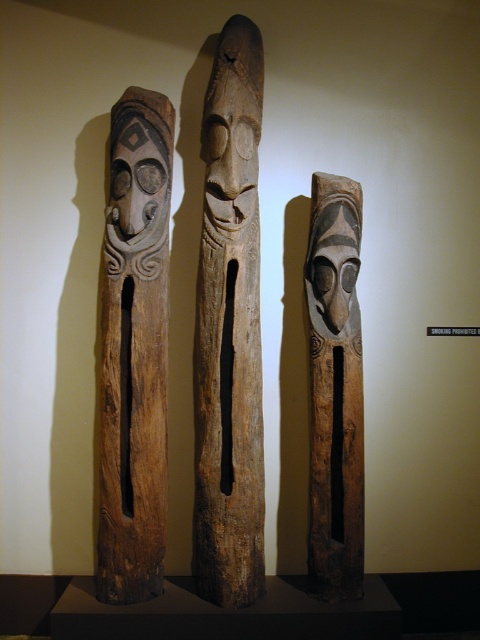
Which is behind, point (116, 330) or point (354, 490)?

Point (354, 490)

Can you confirm if brown wood carving at left is smaller than natural wood mask at center?

Actually, brown wood carving at left might be larger than natural wood mask at center.

The image size is (480, 640). In order to click on brown wood carving at left in this screenshot , I will do `click(133, 349)`.

Between natural wood totem pole at center and brown wood carving at left, which one appears on the left side from the viewer's perspective?

Positioned to the left is brown wood carving at left.

Who is taller, natural wood totem pole at center or brown wood carving at left?

natural wood totem pole at center is taller.

Is point (228, 596) positioned in front of point (156, 291)?

That is True.

Where is `natural wood totem pole at center`? The image size is (480, 640). natural wood totem pole at center is located at coordinates click(229, 330).

Is natural wood totem pole at center positioned at the back of natural wood mask at center?

No, natural wood totem pole at center is closer to the viewer.

Between point (262, 534) and point (359, 330), which one is positioned behind?

The point (359, 330) is behind.

At what (x,y) coordinates should I click in order to perform the action: click on natural wood totem pole at center. Please return your answer as a coordinate pair (x, y). The height and width of the screenshot is (640, 480). Looking at the image, I should click on (229, 330).

This screenshot has height=640, width=480. I want to click on natural wood totem pole at center, so click(229, 330).